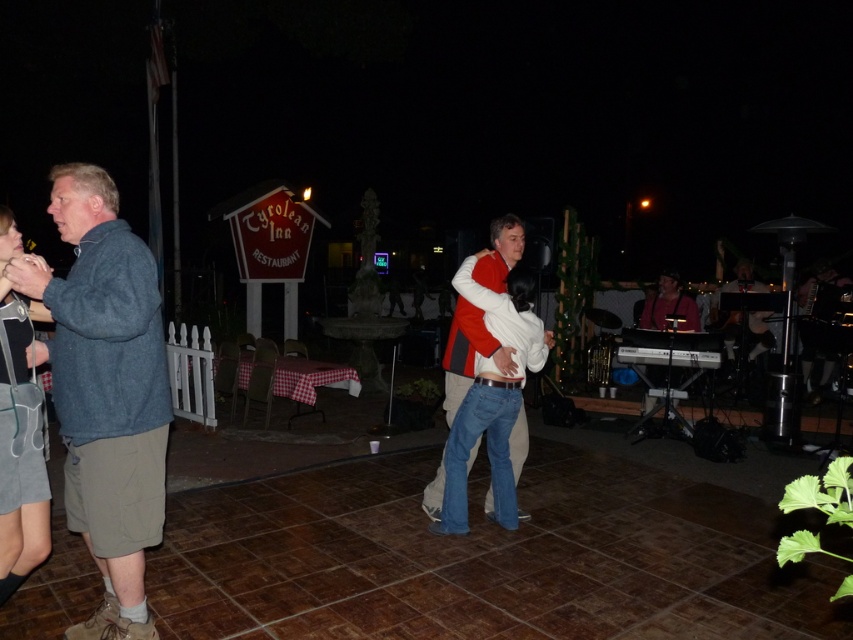
Question: Which point is farther to the camera?

Choices:
 (A) gray denim skirt at lower left
 (B) denim jacket at left
 (C) white cotton shirt at center

Answer: (C)

Question: Among these objects, which one is farthest from the camera?

Choices:
 (A) white cotton shirt at center
 (B) gray denim skirt at lower left

Answer: (A)

Question: Does denim jacket at left appear on the left side of white cotton shirt at center?

Choices:
 (A) no
 (B) yes

Answer: (B)

Question: Where is denim jacket at left located in relation to white cotton shirt at center in the image?

Choices:
 (A) below
 (B) above

Answer: (A)

Question: Does gray denim skirt at lower left have a lesser width compared to white cotton shirt at center?

Choices:
 (A) yes
 (B) no

Answer: (A)

Question: Which point appears farthest from the camera in this image?

Choices:
 (A) (515, 364)
 (B) (106, 323)
 (C) (45, 483)

Answer: (A)